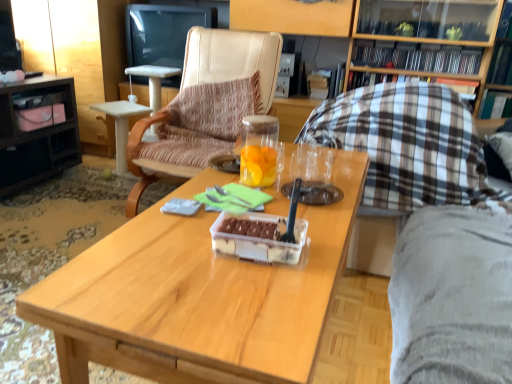
The image size is (512, 384). Find the location of `wooden coffee table at center`. wooden coffee table at center is located at coordinates (197, 295).

The image size is (512, 384). Describe the element at coordinates (37, 131) in the screenshot. I see `matte black desk at left` at that location.

What do you see at coordinates (205, 105) in the screenshot? I see `beige leather chair at center, which is the 2th chair from right to left` at bounding box center [205, 105].

This screenshot has width=512, height=384. Describe the element at coordinates (416, 57) in the screenshot. I see `black plastic books at upper right, marked as the 2th book in a front-to-back arrangement` at that location.

This screenshot has width=512, height=384. Find the location of `black plastic books at upper right, which appears as the second book when viewed from the back`. black plastic books at upper right, which appears as the second book when viewed from the back is located at coordinates (416, 57).

What do you see at coordinates (404, 80) in the screenshot?
I see `plaid fabric pillow at upper right, which appears as the 1th book when viewed from the front` at bounding box center [404, 80].

This screenshot has width=512, height=384. What are the coordinates of `plaid fabric pillow at upper right, acting as the 3th book starting from the back` in the screenshot? It's located at (404, 80).

Find the location of a particular element. The width and height of the screenshot is (512, 384). hardcover book at center, the first book positioned from the back is located at coordinates (301, 80).

The image size is (512, 384). Find the location of `wooden coffee table at center`. wooden coffee table at center is located at coordinates (197, 295).

Based on the photo, which of these two, plaid fabric pillow at upper right, which appears as the 1th book when viewed from the front, or wooden coffee table at center, is smaller?

With smaller size is plaid fabric pillow at upper right, which appears as the 1th book when viewed from the front.

Between plaid fabric pillow at upper right, acting as the 3th book starting from the back, and wooden coffee table at center, which one has larger width?

wooden coffee table at center is wider.

Is plaid fabric pillow at upper right, acting as the 3th book starting from the back, positioned behind wooden coffee table at center?

Yes, the depth of plaid fabric pillow at upper right, acting as the 3th book starting from the back, is greater than that of wooden coffee table at center.

From a real-world perspective, is plaid fabric pillow at upper right, which appears as the 1th book when viewed from the front, on wooden coffee table at center?

Yes, from a real-world perspective, plaid fabric pillow at upper right, which appears as the 1th book when viewed from the front, is over wooden coffee table at center

Is plaid fabric pillow at upper right, which appears as the 1th book when viewed from the front, located outside plaid fabric chair at right, the first chair in the right-to-left sequence?

plaid fabric pillow at upper right, which appears as the 1th book when viewed from the front, lies outside plaid fabric chair at right, the first chair in the right-to-left sequence,'s area.

Does point (372, 76) come farther from viewer compared to point (365, 140)?

Yes, point (372, 76) is behind point (365, 140).

Is plaid fabric chair at right, the 2th chair from the left, at the back of plaid fabric pillow at upper right, which appears as the 1th book when viewed from the front?

No, plaid fabric pillow at upper right, which appears as the 1th book when viewed from the front, is not facing away from plaid fabric chair at right, the 2th chair from the left.

Is plaid fabric pillow at upper right, which appears as the 1th book when viewed from the front, behind plaid fabric chair at right, the first chair in the right-to-left sequence?

Yes, it is.

Considering the relative positions of transparent glass jar at center and beige leather chair at center, the first chair in the left-to-right sequence, in the image provided, is transparent glass jar at center in front of beige leather chair at center, the first chair in the left-to-right sequence,?

Yes, it is.

Image resolution: width=512 pixels, height=384 pixels. What are the coordinates of `coffee cup above the beige leather chair at center, the first chair in the left-to-right sequence (from a real-world perspective)` in the screenshot? It's located at (259, 150).

Is transparent glass jar at center directly adjacent to beige leather chair at center, the first chair in the left-to-right sequence?

No, transparent glass jar at center is not in contact with beige leather chair at center, the first chair in the left-to-right sequence.

From a real-world perspective, who is located higher, beige leather chair at center, which is the 2th chair from right to left, or wooden coffee table at center?

beige leather chair at center, which is the 2th chair from right to left, from a real-world perspective.

This screenshot has height=384, width=512. Find the location of `coffee table that appears below the beige leather chair at center, the first chair in the left-to-right sequence (from a real-world perspective)`. coffee table that appears below the beige leather chair at center, the first chair in the left-to-right sequence (from a real-world perspective) is located at coordinates (197, 295).

Would you say beige leather chair at center, the first chair in the left-to-right sequence, is to the left or to the right of wooden coffee table at center in the picture?

Clearly, beige leather chair at center, the first chair in the left-to-right sequence, is on the left of wooden coffee table at center in the image.

What's the angular difference between beige leather chair at center, which is the 2th chair from right to left, and wooden coffee table at center's facing directions?

90.1 degrees separate the facing orientations of beige leather chair at center, which is the 2th chair from right to left, and wooden coffee table at center.

How different are the orientations of transparent glass jar at center and plaid fabric chair at right, the first chair in the right-to-left sequence, in degrees?

There is a 3.15-degree angle between the facing directions of transparent glass jar at center and plaid fabric chair at right, the first chair in the right-to-left sequence.

Is transparent glass jar at center bigger than plaid fabric chair at right, the first chair in the right-to-left sequence?

No.

Is transparent glass jar at center wider than plaid fabric chair at right, the first chair in the right-to-left sequence?

No, transparent glass jar at center is not wider than plaid fabric chair at right, the first chair in the right-to-left sequence.

Which of these two, transparent glass jar at center or plaid fabric chair at right, the first chair in the right-to-left sequence, stands shorter?

transparent glass jar at center.

Considering the sizes of objects beige leather chair at center, which is the 2th chair from right to left, and hardcover book at center, the first book positioned from the back, in the image provided, who is wider, beige leather chair at center, which is the 2th chair from right to left, or hardcover book at center, the first book positioned from the back,?

beige leather chair at center, which is the 2th chair from right to left.

Is beige leather chair at center, the first chair in the left-to-right sequence, not close to hardcover book at center, the 3th book when ordered from front to back?

That's not correct — beige leather chair at center, the first chair in the left-to-right sequence, is a little close to hardcover book at center, the 3th book when ordered from front to back.

Looking at this image, between beige leather chair at center, which is the 2th chair from right to left, and hardcover book at center, the first book positioned from the back, which one has less height?

hardcover book at center, the first book positioned from the back.

Is matte black desk at left wider or thinner than transparent glass jar at center?

matte black desk at left is wider than transparent glass jar at center.

Locate an element on the screen. This screenshot has height=384, width=512. coffee cup located on the right of matte black desk at left is located at coordinates click(x=259, y=150).

How distant is matte black desk at left from transparent glass jar at center?

matte black desk at left and transparent glass jar at center are 1.65 meters apart.

Is matte black desk at left inside or outside of transparent glass jar at center?

matte black desk at left exists outside the volume of transparent glass jar at center.

Which book is the 2nd one when counting from the right side of the wooden coffee table at center? Please provide its 2D coordinates.

[(404, 80)]

From a real-world perspective, which book is the 2nd one above the plaid fabric chair at right, the 2th chair from the left? Please provide its 2D coordinates.

[(404, 80)]

Based on their spatial positions, is transparent glass jar at center or matte black desk at left closer to black glossy television at upper center?

matte black desk at left lies closer to black glossy television at upper center than the other object.

When comparing their distances from transparent glass jar at center, does beige leather chair at center, which is the 2th chair from right to left, or black plastic books at upper right, which appears as the second book when viewed from the back, seem closer?

beige leather chair at center, which is the 2th chair from right to left, is closer to transparent glass jar at center.

Based on their spatial positions, is black plastic books at upper right, which appears as the second book when viewed from the back, or transparent glass jar at center further from wooden coffee table at center?

black plastic books at upper right, which appears as the second book when viewed from the back, lies further to wooden coffee table at center than the other object.

Looking at this image, which object lies nearer to the anchor point plaid fabric pillow at upper right, acting as the 3th book starting from the back, matte black desk at left or wooden coffee table at center?

wooden coffee table at center is closer to plaid fabric pillow at upper right, acting as the 3th book starting from the back.

Based on their spatial positions, is plaid fabric chair at right, the 2th chair from the left, or wooden coffee table at center further from hardcover book at center, the 3th book when ordered from front to back?

Based on the image, wooden coffee table at center appears to be further to hardcover book at center, the 3th book when ordered from front to back.

Looking at the image, which one is located further to wooden coffee table at center, black glossy television at upper center or transparent glass jar at center?

Based on the image, black glossy television at upper center appears to be further to wooden coffee table at center.

From the image, which object appears to be farther from black plastic books at upper right, which appears as the second book when viewed from the back, black glossy television at upper center or beige leather chair at center, the first chair in the left-to-right sequence?

Among the two, black glossy television at upper center is located further to black plastic books at upper right, which appears as the second book when viewed from the back.

Considering their positions, is plaid fabric chair at right, the first chair in the right-to-left sequence, positioned closer to plaid fabric pillow at upper right, which appears as the 1th book when viewed from the front, than wooden coffee table at center?

Based on the image, plaid fabric chair at right, the first chair in the right-to-left sequence, appears to be nearer to plaid fabric pillow at upper right, which appears as the 1th book when viewed from the front.

At what (x,y) coordinates should I click in order to perform the action: click on coffee table situated between matte black desk at left and plaid fabric chair at right, the first chair in the right-to-left sequence, from left to right. Please return your answer as a coordinate pair (x, y). Looking at the image, I should click on (197, 295).

This screenshot has height=384, width=512. What are the coordinates of `desk between wooden coffee table at center and hardcover book at center, the first book positioned from the back, from front to back` in the screenshot? It's located at (37, 131).

This screenshot has height=384, width=512. What are the coordinates of `coffee cup located between wooden coffee table at center and black plastic books at upper right, marked as the 2th book in a front-to-back arrangement, in the depth direction` in the screenshot? It's located at (259, 150).

Where is `book situated between hardcover book at center, the first book positioned from the back, and black plastic books at upper right, which appears as the second book when viewed from the back, from left to right`? book situated between hardcover book at center, the first book positioned from the back, and black plastic books at upper right, which appears as the second book when viewed from the back, from left to right is located at coordinates (404, 80).